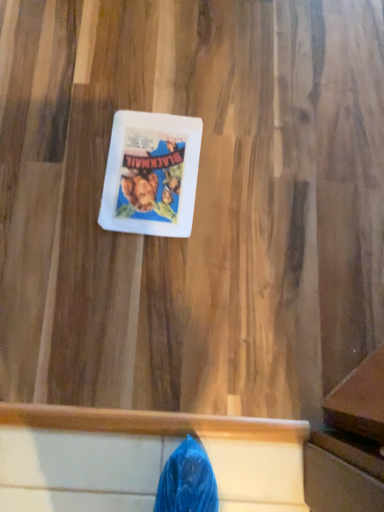
Identify the location of unoccupied space behind white matte comic book at center. (162, 83).